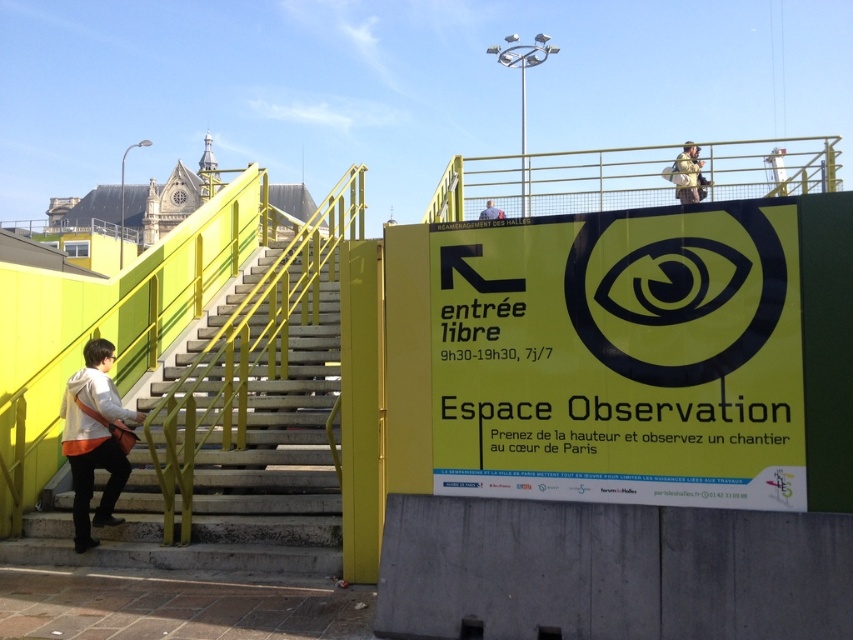
You are a tourist holding a camouflage fabric backpack at upper center and want to read the yellow matte sign at center. Can you easily see the text on the sign?

The yellow matte sign at center is positioned under the camouflage fabric backpack at upper center, so the backpack is blocking your view of the sign. You may need to move the backpack or reposition yourself to read the text clearly.

You are a visitor at the Espace Observation and want to reach the observation deck. You see the yellow metal stairs at left and the matte blue shirt at upper center. Which object is taller and would require more effort to climb?

The yellow metal stairs at left is taller than the matte blue shirt at upper center, so it would require more effort to climb.

You are standing at the bottom of the yellow metal stairs at left and want to approach the matte blue shirt at upper center. Which direction should you move to reach it?

To reach the matte blue shirt at upper center, you should move to the right since the yellow metal stairs at left is positioned on the left side of the matte blue shirt at upper center.